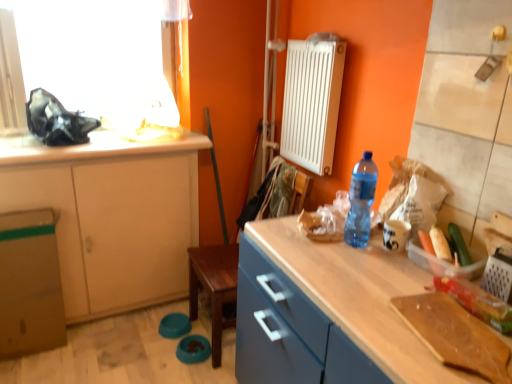
Identify the location of blank space to the left of wooden cutting board at lower right. The width and height of the screenshot is (512, 384). (373, 328).